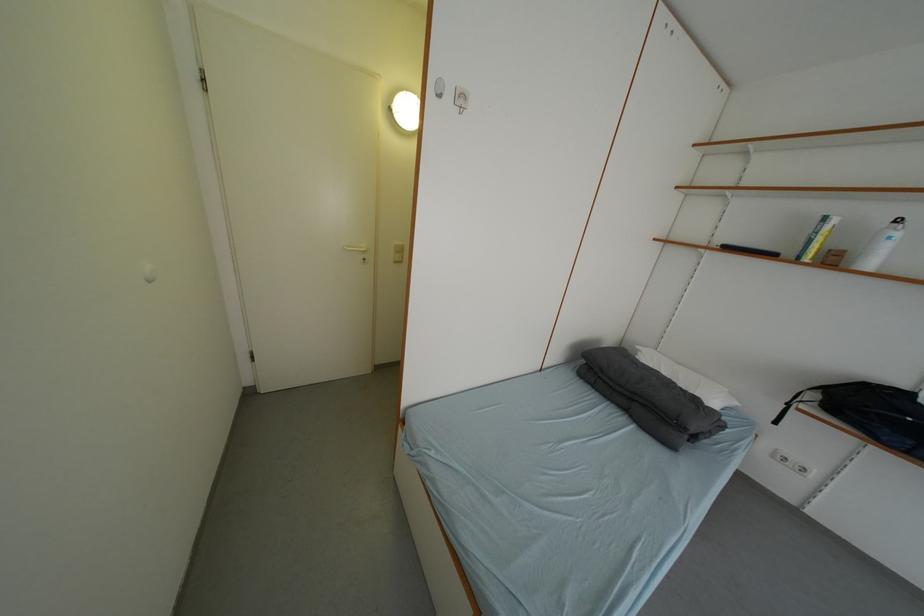
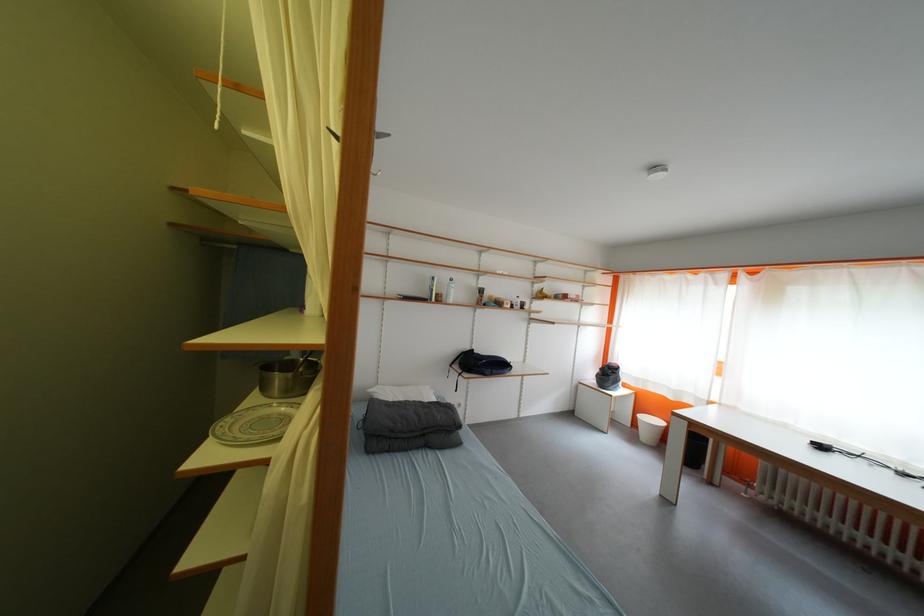
Find the pixel in the second image that matches pixel 823 399 in the first image.

(466, 370)